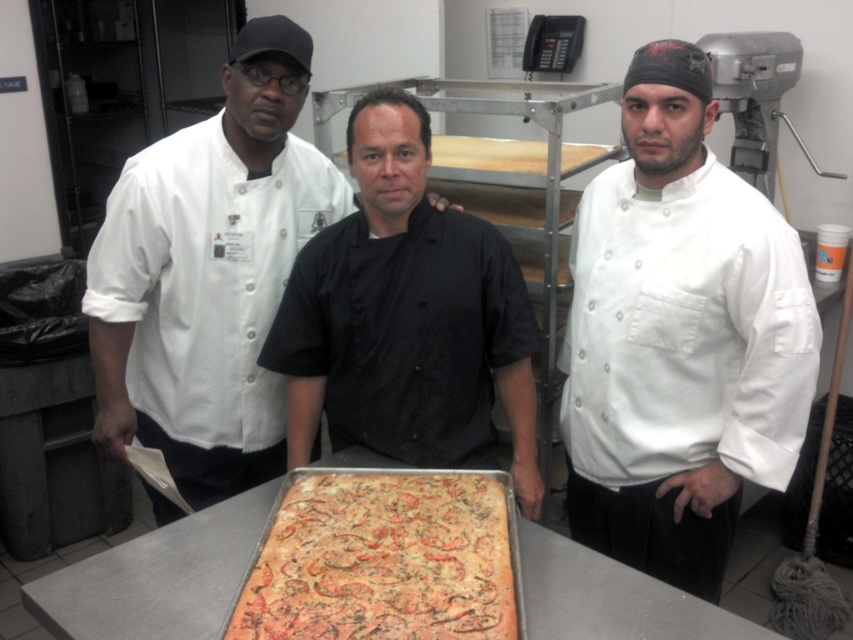
Based on the scene description, where is the white matte chef coat at center located in the image?

The white matte chef coat at center is located at the 2D coordinates point (x=679, y=337).